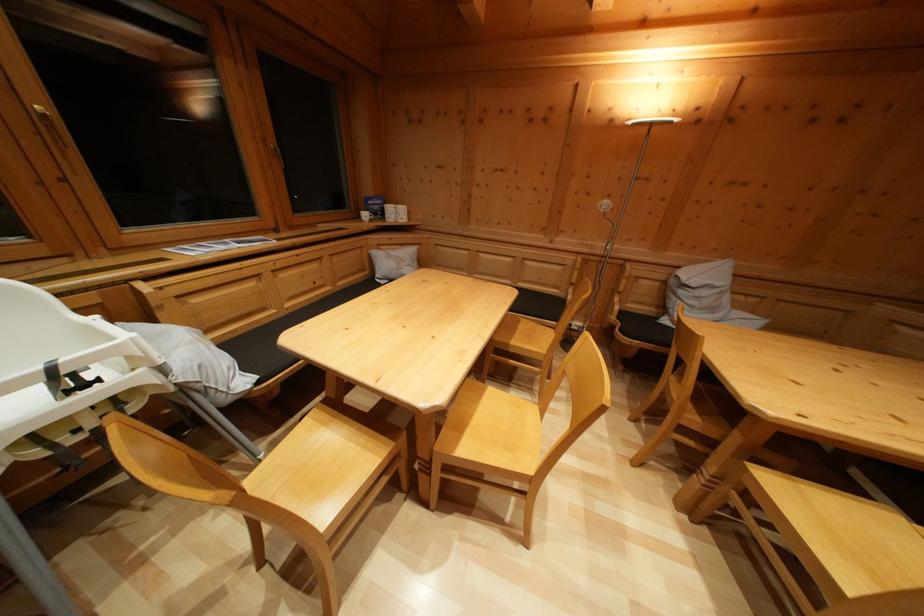
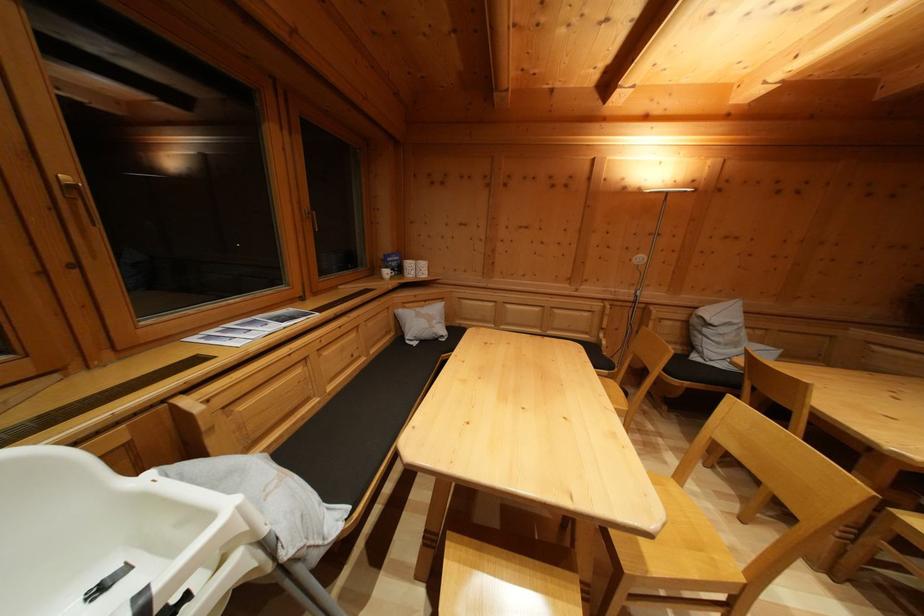
The point at (463, 451) is marked in the first image. Where is the corresponding point in the second image?

(647, 564)